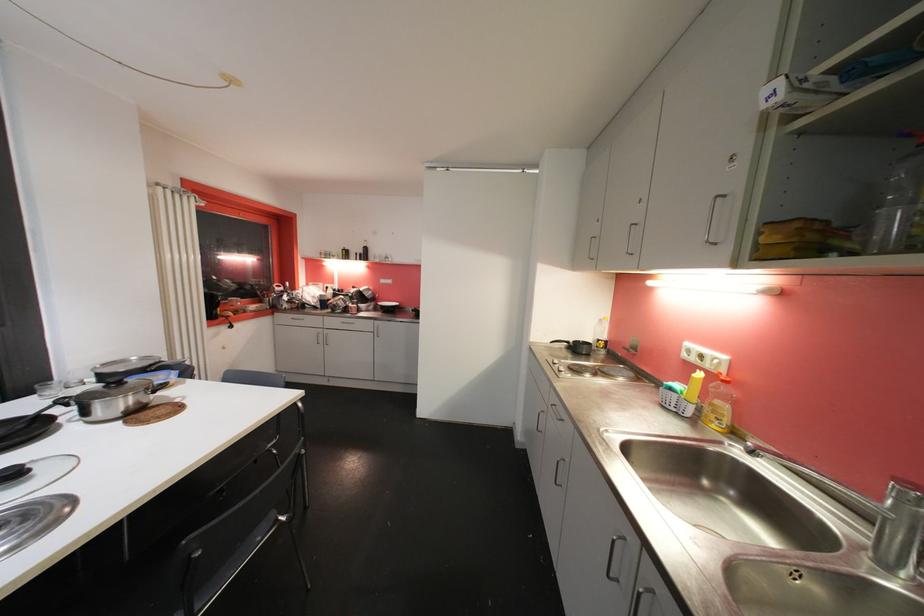
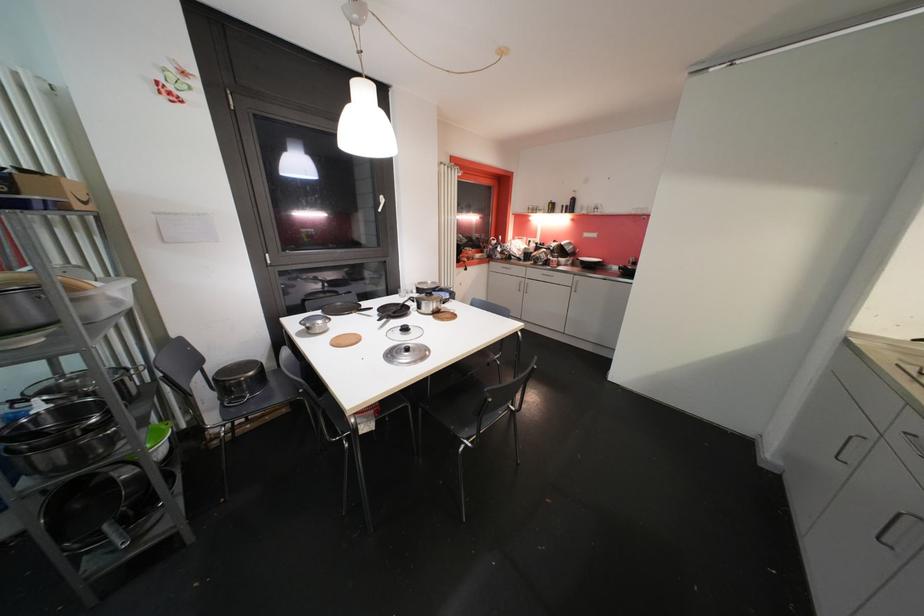
Where in the second image is the point corresponding to (565,466) from the first image?

(915, 522)